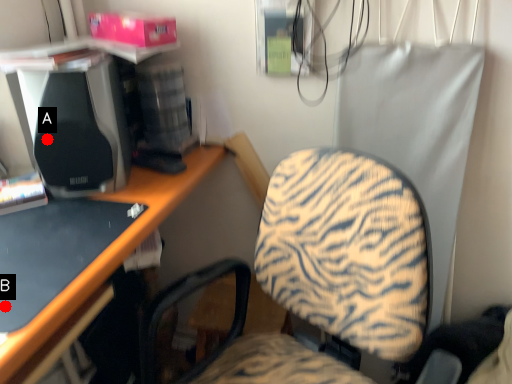
Question: Two points are circled on the image, labeled by A and B beside each circle. Which point is farther from the camera taking this photo?

Choices:
 (A) A is further
 (B) B is further

Answer: (A)